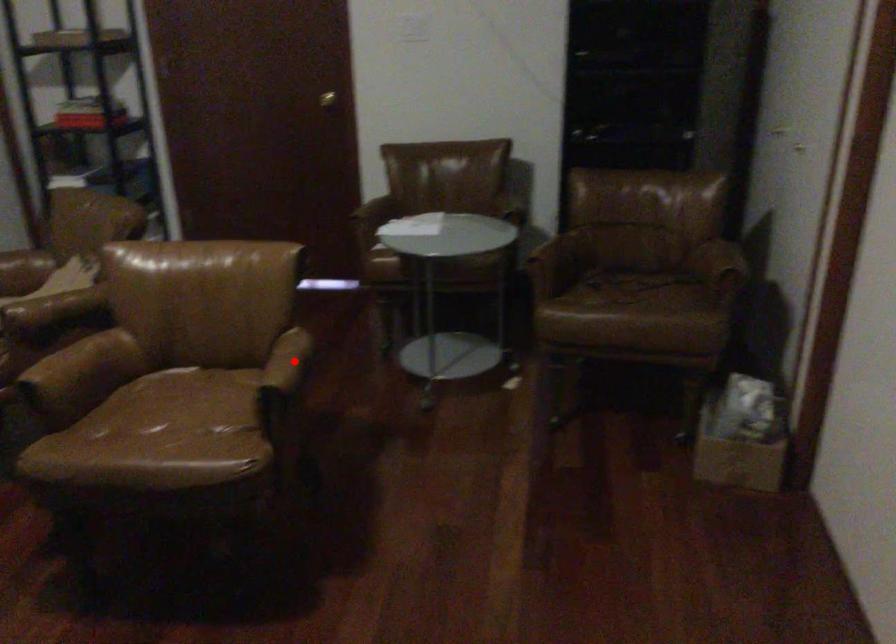
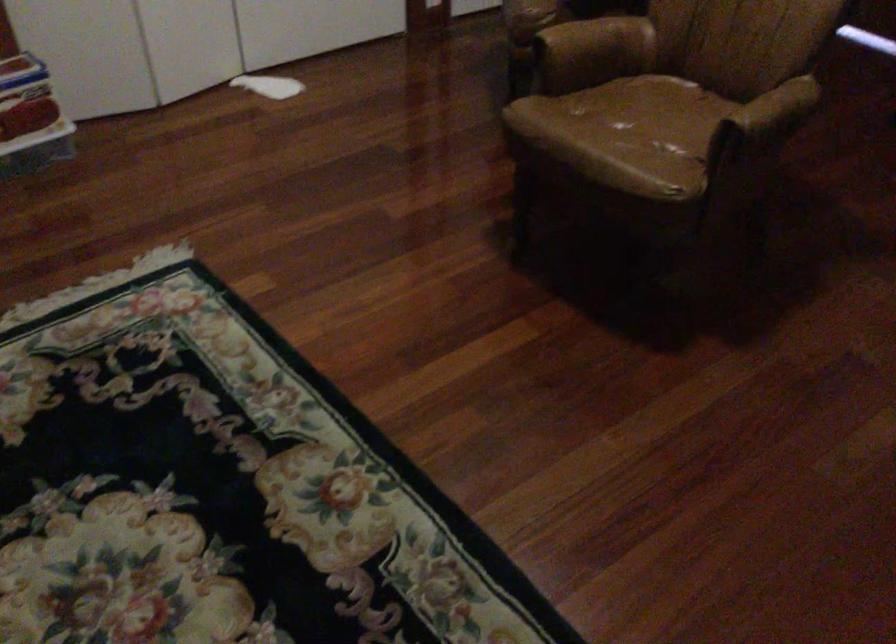
Question: I am providing you with two images of the same scene from different viewpoints. In image1, a red point is highlighted. Considering the same 3D point in image2, which of the following is correct?

Choices:
 (A) It is closer
 (B) It is farther

Answer: (A)